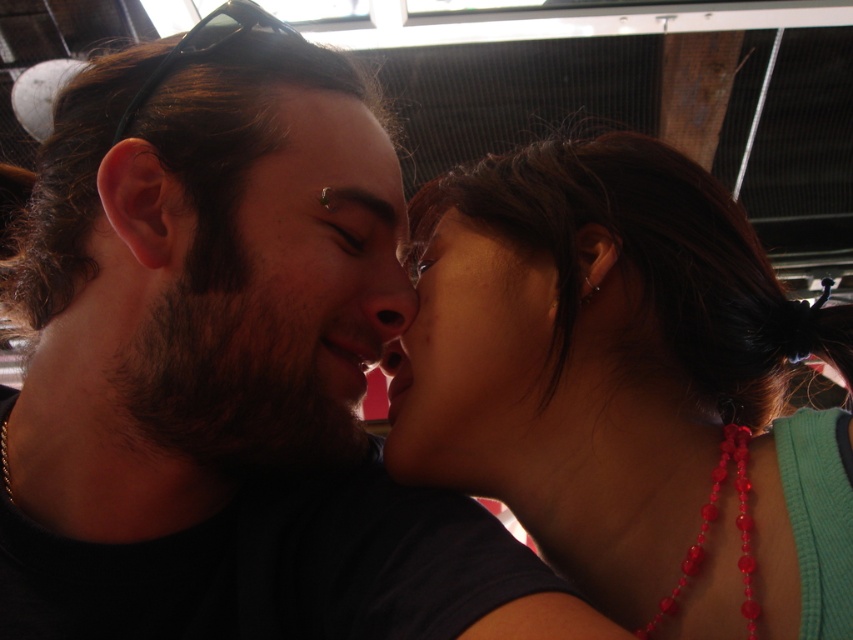
You are a photographer standing in front of the teal fabric shirt at center. You want to take a photo of the shirt without any blur. What should you do to ensure the shirt is in focus?

The teal fabric shirt at center is 19.60 inches from the viewer. To ensure it is in focus, adjust your camera focus to 19.60 inches distance.